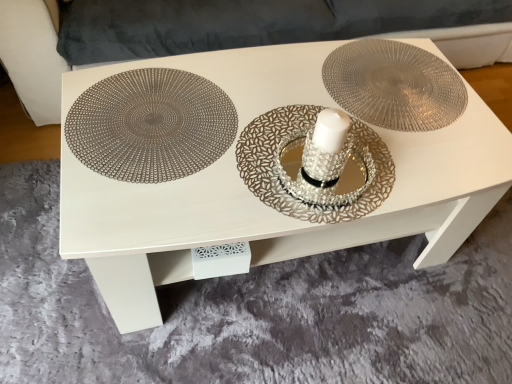
Question: Are suede-like gray couch at upper center and metallic woven placemat at left far apart?

Choices:
 (A) no
 (B) yes

Answer: (B)

Question: Is suede-like gray couch at upper center facing towards metallic woven placemat at left?

Choices:
 (A) no
 (B) yes

Answer: (B)

Question: Is suede-like gray couch at upper center bigger than metallic woven placemat at left?

Choices:
 (A) yes
 (B) no

Answer: (A)

Question: Can you confirm if suede-like gray couch at upper center is wider than metallic woven placemat at left?

Choices:
 (A) yes
 (B) no

Answer: (A)

Question: Is suede-like gray couch at upper center positioned beyond the bounds of metallic woven placemat at left?

Choices:
 (A) yes
 (B) no

Answer: (A)

Question: Considering the positions of point (33, 76) and point (314, 59), is point (33, 76) closer or farther from the camera than point (314, 59)?

Choices:
 (A) farther
 (B) closer

Answer: (A)

Question: In terms of width, does suede-like gray couch at upper center look wider or thinner when compared to metallic placemat at center?

Choices:
 (A) wide
 (B) thin

Answer: (A)

Question: From a real-world perspective, is suede-like gray couch at upper center physically located above or below metallic placemat at center?

Choices:
 (A) below
 (B) above

Answer: (B)

Question: From the image's perspective, is suede-like gray couch at upper center located above or below metallic placemat at center?

Choices:
 (A) below
 (B) above

Answer: (B)

Question: Is metallic placemat at center bigger or smaller than metallic woven placemat at left?

Choices:
 (A) small
 (B) big

Answer: (B)

Question: From the image's perspective, is metallic placemat at center positioned above or below metallic woven placemat at left?

Choices:
 (A) above
 (B) below

Answer: (B)

Question: From a real-world perspective, is metallic placemat at center physically located above or below metallic woven placemat at left?

Choices:
 (A) below
 (B) above

Answer: (A)

Question: In terms of height, does metallic placemat at center look taller or shorter compared to metallic woven placemat at left?

Choices:
 (A) short
 (B) tall

Answer: (B)

Question: Considering the positions of suede-like gray couch at upper center and silver textured plate at center in the image, is suede-like gray couch at upper center bigger or smaller than silver textured plate at center?

Choices:
 (A) small
 (B) big

Answer: (B)

Question: Does point (14, 3) appear closer or farther from the camera than point (270, 200)?

Choices:
 (A) farther
 (B) closer

Answer: (A)